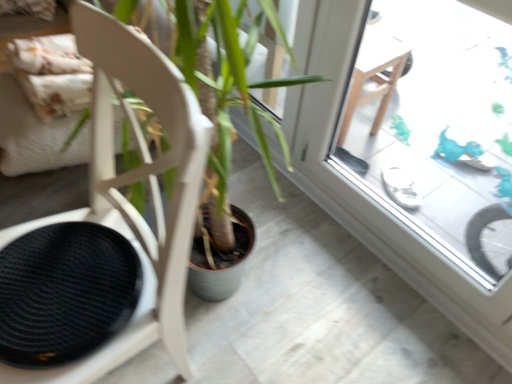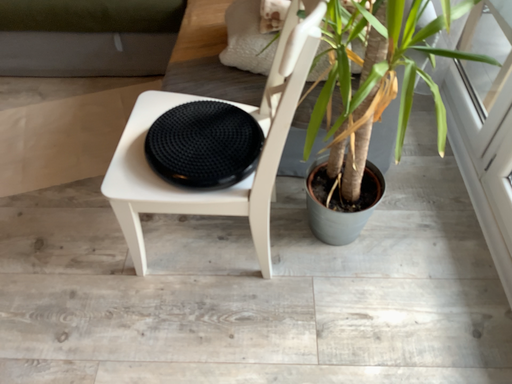
Question: Which way did the camera rotate in the video?

Choices:
 (A) rotated right
 (B) rotated left

Answer: (B)